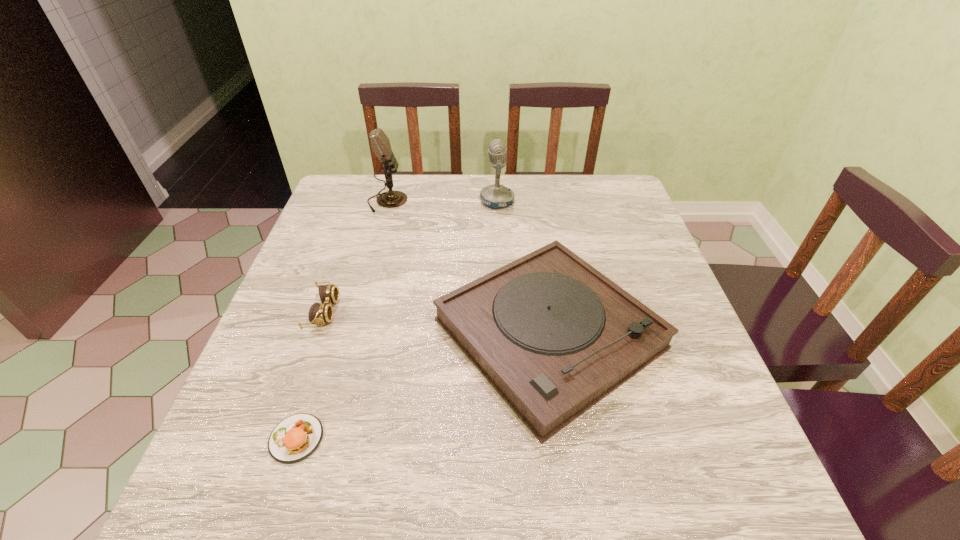
This screenshot has width=960, height=540. What are the coordinates of `free space that is in between the left microphone and the patty` in the screenshot? It's located at (342, 320).

Find the location of `free spot between the third tallest object and the goggles`. free spot between the third tallest object and the goggles is located at coordinates (436, 323).

Find the location of a particular element. This screenshot has height=540, width=960. vacant area between the goggles and the right microphone is located at coordinates (410, 256).

You are a GUI agent. You are given a task and a screenshot of the screen. Output one action in this format:
    pyautogui.click(x=<x>, y=<y>)
    Task: Click on the free space between the phonograph record and the fourth tallest object
    
    Given the screenshot: What is the action you would take?
    pyautogui.click(x=436, y=323)

I want to click on blank region between the left microphone and the shortest object, so click(342, 320).

The image size is (960, 540). I want to click on free space between the right microphone and the second shortest object, so click(410, 256).

Identify the location of the closest object to the right microphone. The height and width of the screenshot is (540, 960). (553, 336).

At what (x,y) coordinates should I click in order to perform the action: click on object that is the third nearest to the left microphone. Please return your answer as a coordinate pair (x, y). Looking at the image, I should click on click(x=322, y=313).

Find the location of a particular element. Image resolution: width=960 pixels, height=540 pixels. vacant space that satisfies the following two spatial constraints: 1. on the front-facing side of the left microphone; 2. on the right side of the third tallest object is located at coordinates (350, 334).

Locate an element on the screen. This screenshot has width=960, height=540. vacant region that satisfies the following two spatial constraints: 1. on the front-facing side of the third tallest object; 2. on the left side of the left microphone is located at coordinates (350, 334).